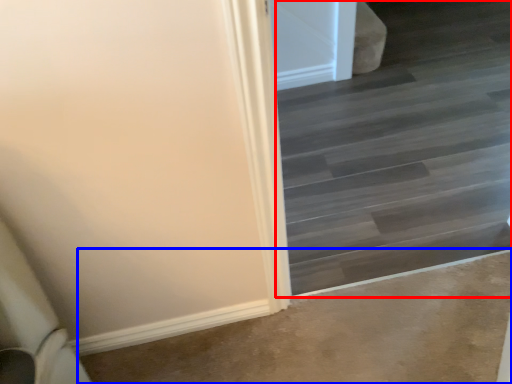
Question: Among these objects, which one is nearest to the camera, stairwell (highlighted by a red box) or concrete (highlighted by a blue box)?

Choices:
 (A) stairwell
 (B) concrete

Answer: (A)